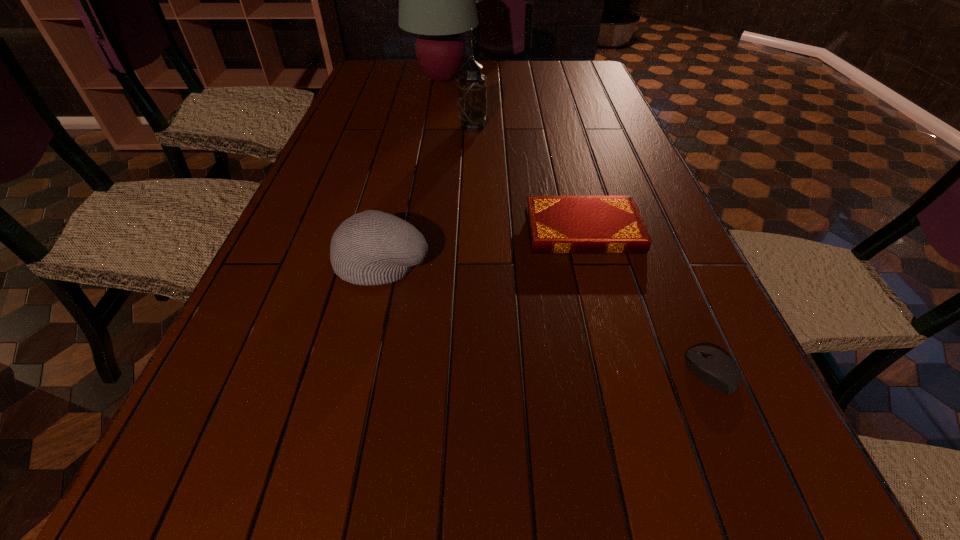
This screenshot has height=540, width=960. In order to click on free space at the right edge in this screenshot , I will do `click(570, 88)`.

At what (x,y) coordinates should I click in order to perform the action: click on vacant space at the far left corner of the desktop. Please return your answer as a coordinate pair (x, y). Looking at the image, I should click on (364, 83).

In order to click on free space between the computer equipment and the hardback book in this screenshot , I will do `click(647, 301)`.

Find the location of a particular element. The width and height of the screenshot is (960, 540). unoccupied area between the beanie and the farthest object is located at coordinates (413, 170).

Image resolution: width=960 pixels, height=540 pixels. Find the location of `free space between the lampshade and the beanie`. free space between the lampshade and the beanie is located at coordinates click(x=413, y=170).

This screenshot has height=540, width=960. What are the coordinates of `free space between the lampshade and the third tallest object` in the screenshot? It's located at (413, 170).

Locate an element on the screen. The width and height of the screenshot is (960, 540). vacant space that is in between the third tallest object and the tallest object is located at coordinates (413, 170).

At what (x,y) coordinates should I click in order to perform the action: click on object that is the fourth nearest to the third tallest object. Please return your answer as a coordinate pair (x, y). Looking at the image, I should click on (437, 0).

Where is `the closest object to the lampshade`? The image size is (960, 540). the closest object to the lampshade is located at coordinates (472, 90).

Where is `vacant space that satisfies the following two spatial constraints: 1. on the cover of the hardback book; 2. on the back side of the computer equipment`? The width and height of the screenshot is (960, 540). vacant space that satisfies the following two spatial constraints: 1. on the cover of the hardback book; 2. on the back side of the computer equipment is located at coordinates (620, 372).